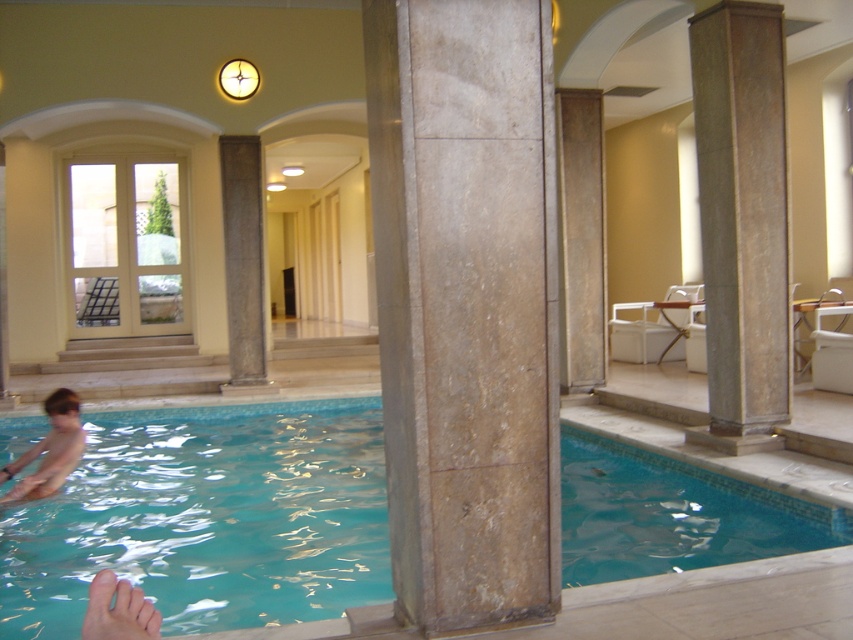
You are designing a safety plan for the pool area and need to ensure that the brown stone column at center and the smooth skin foot at lower left are spaced appropriately. Based on their sizes, which object requires more space around it for safety purposes?

The brown stone column at center requires more space around it for safety purposes because it has a larger size compared to the smooth skin foot at lower left.

You are designing a new swimming pool and want to ensure there is enough space between the marble column at center and the clear blue water at lower left for a maintenance walkway. If the walkway requires a minimum width of 2 meters, can you determine if there is sufficient space based on the provided information?

The marble column at center has a width less than the clear blue water at lower left, but the exact dimensions are not provided. Without knowing the specific widths, it is impossible to determine if the space between them meets the 2 meter requirement.

Based on the photo, you are navigating a small remote control boat from the arched doorway towards the pool. The boat must avoid obstacles. According to the coordinates provided, where is the brown stone column at center positioned relative to the boat starting point?

The brown stone column at center is located at coordinates point (242,262), so the boat should steer around this position to avoid collision.